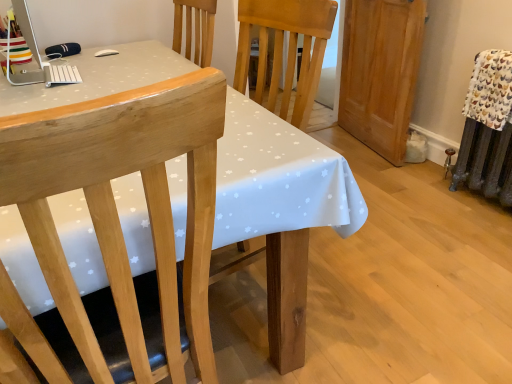
This screenshot has width=512, height=384. What are the coordinates of `light brown wood armoire at right` in the screenshot? It's located at (380, 72).

Looking at this image, what is the approximate width of light brown wood armoire at right?

The width of light brown wood armoire at right is 9.00 inches.

What is the approximate height of natural wood chair at left?

natural wood chair at left is 1.07 meters tall.

Describe the element at coordinates (39, 57) in the screenshot. I see `white plastic desktop computer at upper left` at that location.

Describe the element at coordinates (490, 89) in the screenshot. I see `white fabric with chicken print at right` at that location.

This screenshot has height=384, width=512. I want to click on white fabric with chicken print at right, so click(490, 89).

At what (x,y) coordinates should I click in order to perform the action: click on white dotted fabric at center. Please return your answer as a coordinate pair (x, y). This screenshot has width=512, height=384. Looking at the image, I should click on (278, 178).

In terms of width, does white dotted fabric at center look wider or thinner when compared to white fabric with chicken print at right?

white dotted fabric at center is wider than white fabric with chicken print at right.

Is white dotted fabric at center bigger or smaller than white fabric with chicken print at right?

In the image, white dotted fabric at center appears to be larger than white fabric with chicken print at right.

Would you consider white dotted fabric at center to be distant from white fabric with chicken print at right?

Absolutely, white dotted fabric at center is distant from white fabric with chicken print at right.

Identify the location of chair to the right of white dotted fabric at center. The width and height of the screenshot is (512, 384). (116, 230).

Can you tell me how much white dotted fabric at center and natural wood chair at left differ in facing direction?

180 degrees.

Considering the relative sizes of white dotted fabric at center and natural wood chair at left in the image provided, is white dotted fabric at center taller than natural wood chair at left?

No.

Which object is positioned more to the right, white dotted fabric at center or natural wood chair at left?

natural wood chair at left.

Is natural wood chair at left aimed at white dotted fabric at center?

Yes, natural wood chair at left is turned towards white dotted fabric at center.

How different are the orientations of natural wood chair at left and white dotted fabric at center in degrees?

The angle between the facing direction of natural wood chair at left and the facing direction of white dotted fabric at center is 180 degrees.

Is natural wood chair at left outside of white dotted fabric at center?

No, most part of natural wood chair at left lies within white dotted fabric at center.

From a real-world perspective, who is located lower, natural wood chair at left or white dotted fabric at center?

white dotted fabric at center, from a real-world perspective.

Are light brown wood armoire at right and white fabric with chicken print at right far apart?

light brown wood armoire at right is actually quite close to white fabric with chicken print at right.

Does light brown wood armoire at right turn towards white fabric with chicken print at right?

No, light brown wood armoire at right is not turned towards white fabric with chicken print at right.

From the image's perspective, between light brown wood armoire at right and white fabric with chicken print at right, which one is located above?

light brown wood armoire at right is shown above in the image.

Is white fabric with chicken print at right a part of light brown wood armoire at right?

No, white fabric with chicken print at right is not inside light brown wood armoire at right.

Would you consider white plastic desktop computer at upper left to be distant from white dotted fabric at center?

No.

Considering the positions of objects white plastic desktop computer at upper left and white dotted fabric at center in the image provided, who is more to the right, white plastic desktop computer at upper left or white dotted fabric at center?

Positioned to the right is white dotted fabric at center.

What are the coordinates of `tablecloth that appears below the white plastic desktop computer at upper left (from a real-world perspective)` in the screenshot? It's located at (278, 178).

Is the surface of white plastic desktop computer at upper left in direct contact with white fabric with chicken print at right?

white plastic desktop computer at upper left and white fabric with chicken print at right are clearly separated.

Is white fabric with chicken print at right a part of white plastic desktop computer at upper left?

No, white fabric with chicken print at right is not inside white plastic desktop computer at upper left.

Considering the relative positions of white plastic desktop computer at upper left and white fabric with chicken print at right in the image provided, is white plastic desktop computer at upper left to the left or to the right of white fabric with chicken print at right?

In the image, white plastic desktop computer at upper left appears on the left side of white fabric with chicken print at right.

Is white plastic desktop computer at upper left oriented away from white fabric with chicken print at right?

No, white fabric with chicken print at right is not at the back of white plastic desktop computer at upper left.

From a real-world perspective, who is located lower, white fabric with chicken print at right or white dotted fabric at center?

white dotted fabric at center.

How much distance is there between white fabric with chicken print at right and white dotted fabric at center?

1.47 meters.

In terms of height, does white fabric with chicken print at right look taller or shorter compared to white dotted fabric at center?

white fabric with chicken print at right is shorter than white dotted fabric at center.

Is the depth of white fabric with chicken print at right less than that of white dotted fabric at center?

No, the depth of white fabric with chicken print at right is greater than that of white dotted fabric at center.

Where is `blanket that appears above the white dotted fabric at center (from the image's perspective)`? The height and width of the screenshot is (384, 512). blanket that appears above the white dotted fabric at center (from the image's perspective) is located at coordinates (490, 89).

Find the location of a particular element. chair on the right of white dotted fabric at center is located at coordinates (116, 230).

When comparing their distances from white fabric with chicken print at right, does natural wood chair at left or white plastic desktop computer at upper left seem further?

The object further to white fabric with chicken print at right is white plastic desktop computer at upper left.

Considering their positions, is white plastic desktop computer at upper left positioned closer to white dotted fabric at center than natural wood chair at left?

white plastic desktop computer at upper left.

Which object lies further to the anchor point white plastic desktop computer at upper left, white dotted fabric at center or natural wood chair at left?

natural wood chair at left lies further to white plastic desktop computer at upper left than the other object.

Based on their spatial positions, is white plastic desktop computer at upper left or white dotted fabric at center closer to natural wood chair at left?

The object closer to natural wood chair at left is white dotted fabric at center.

From the image, which object appears to be farther from white plastic desktop computer at upper left, white fabric with chicken print at right or natural wood chair at left?

The object further to white plastic desktop computer at upper left is white fabric with chicken print at right.

Which object lies nearer to the anchor point natural wood chair at left, white plastic desktop computer at upper left or light brown wood armoire at right?

white plastic desktop computer at upper left is positioned closer to the anchor natural wood chair at left.

Looking at the image, which one is located closer to light brown wood armoire at right, white fabric with chicken print at right or white dotted fabric at center?

Among the two, white fabric with chicken print at right is located nearer to light brown wood armoire at right.

Estimate the real-world distances between objects in this image. Which object is further from light brown wood armoire at right, white fabric with chicken print at right or natural wood chair at left?

natural wood chair at left is positioned further to the anchor light brown wood armoire at right.

Locate an element on the screen. This screenshot has height=384, width=512. tablecloth between natural wood chair at left and light brown wood armoire at right from front to back is located at coordinates (278, 178).

I want to click on armoire between white plastic desktop computer at upper left and white fabric with chicken print at right in the horizontal direction, so click(380, 72).

At what (x,y) coordinates should I click in order to perform the action: click on tablecloth between white plastic desktop computer at upper left and light brown wood armoire at right. Please return your answer as a coordinate pair (x, y). Looking at the image, I should click on [278, 178].

What are the coordinates of `chair between white plastic desktop computer at upper left and white fabric with chicken print at right` in the screenshot? It's located at (116, 230).